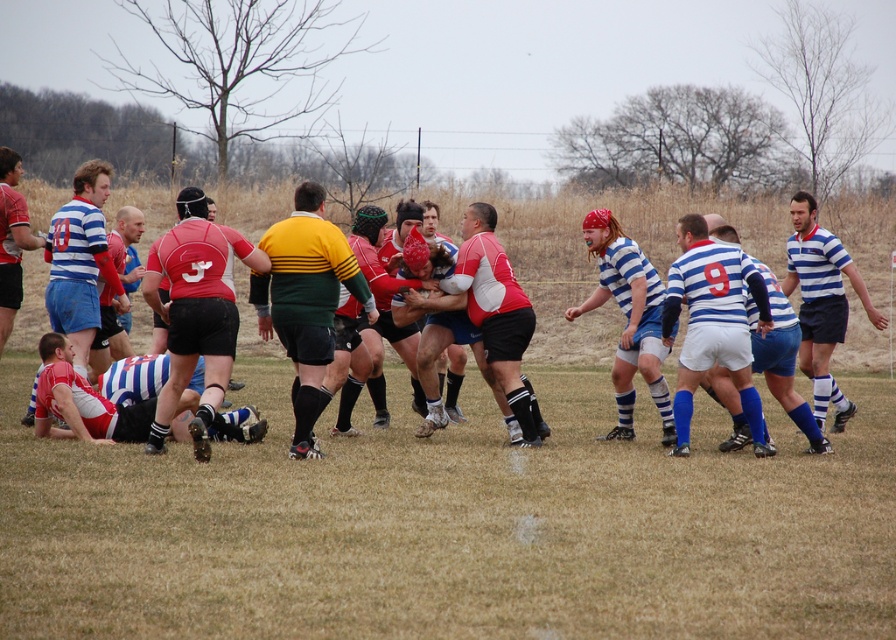
Is matte red rugby ball at center smaller than blue striped jersey at center?

No, matte red rugby ball at center is not smaller than blue striped jersey at center.

Who is lower down, matte red rugby ball at center or blue striped jersey at center?

blue striped jersey at center is below.

Does point (608, 356) come behind point (714, 292)?

That is True.

Identify the location of matte red rugby ball at center. The image size is (896, 640). pos(596,260).

Can you confirm if matte red rugby ball at center is positioned to the right of blue striped jersey at right?

No, matte red rugby ball at center is not to the right of blue striped jersey at right.

How far apart are matte red rugby ball at center and blue striped jersey at right?

matte red rugby ball at center is 12.51 meters from blue striped jersey at right.

Find the location of `matte red rugby ball at center`. matte red rugby ball at center is located at coordinates (596, 260).

Is point (283, 308) positioned behind point (812, 358)?

No, it is in front of (812, 358).

Which of these two, yellow-green jersey at center or blue striped jersey at right, stands taller?

blue striped jersey at right

Locate an element on the screen. The height and width of the screenshot is (640, 896). yellow-green jersey at center is located at coordinates (306, 300).

The width and height of the screenshot is (896, 640). I want to click on yellow-green jersey at center, so click(x=306, y=300).